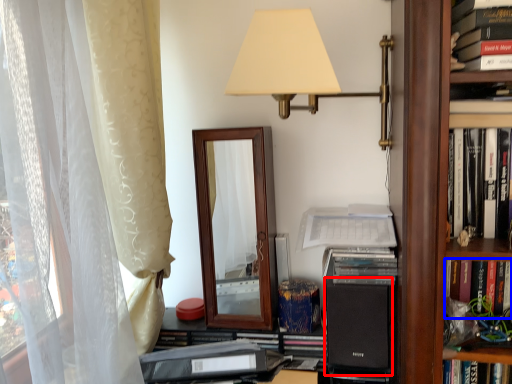
Question: Which object is closer to the camera taking this photo, speaker (highlighted by a red box) or book (highlighted by a blue box)?

Choices:
 (A) speaker
 (B) book

Answer: (B)